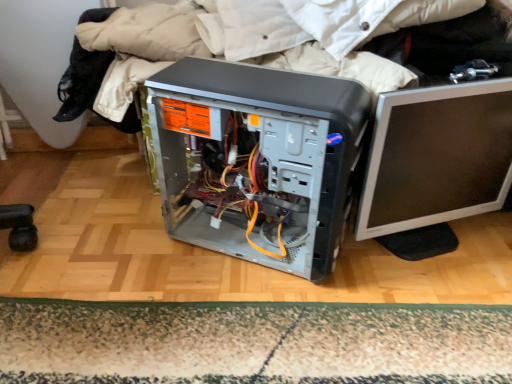
Where is `vacant space in front of silver/black plastic monitor at right`? This screenshot has width=512, height=384. vacant space in front of silver/black plastic monitor at right is located at coordinates (431, 306).